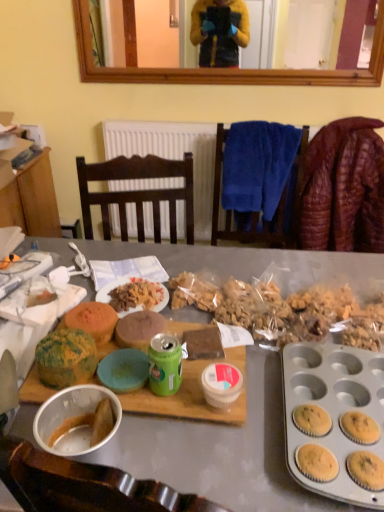
This screenshot has height=512, width=384. What do you see at coordinates (224, 450) in the screenshot? I see `matte gray desk at center` at bounding box center [224, 450].

This screenshot has height=512, width=384. Describe the element at coordinates (111, 289) in the screenshot. I see `matte plastic plate at center` at that location.

Measure the distance between matte plastic plate at center and camera.

A distance of 3.32 feet exists between matte plastic plate at center and camera.

Describe the element at coordinates (251, 213) in the screenshot. This screenshot has height=512, width=384. I see `blue soft towel at upper center` at that location.

You are a GUI agent. You are given a task and a screenshot of the screen. Output one action in this format:
    pyautogui.click(x=<x>, y=<y>)
    Task: Click on the matte gray desk at center
    
    Given the screenshot: What is the action you would take?
    pyautogui.click(x=224, y=450)

Between point (380, 170) and point (52, 342), which one is positioned in front?

Point (52, 342)

Between leather jacket at right and speckled yellow muffin at center-left, which appears as the second snack when viewed from the back, which one has larger width?

leather jacket at right.

Which is behind, leather jacket at right or speckled yellow muffin at center-left, which appears as the second snack when viewed from the back?

leather jacket at right is behind.

From a real-world perspective, which object stands above the other?

speckled yellow muffin at center-left, which is the 1th snack from front to back, from a real-world perspective.

Can you confirm if matte plastic plate at center is thinner than blue soft towel at upper center?

Incorrect, the width of matte plastic plate at center is not less than that of blue soft towel at upper center.

From the image's perspective, is matte plastic plate at center positioned above or below blue soft towel at upper center?

Clearly, from the image's perspective, matte plastic plate at center is below blue soft towel at upper center.

Based on their sizes in the image, would you say matte plastic plate at center is bigger or smaller than blue soft towel at upper center?

Clearly, matte plastic plate at center is smaller in size than blue soft towel at upper center.

From a real-world perspective, is matte plastic plate at center physically above blue soft towel at upper center?

No.

From the picture: Which object is thinner, speckled yellow muffin at center-left, which is the 1th snack from front to back, or matte plastic plate at center?

With smaller width is speckled yellow muffin at center-left, which is the 1th snack from front to back.

Is speckled yellow muffin at center-left, which appears as the second snack when viewed from the back, taller or shorter than matte plastic plate at center?

Considering their sizes, speckled yellow muffin at center-left, which appears as the second snack when viewed from the back, has more height than matte plastic plate at center.

From the picture: Can you see speckled yellow muffin at center-left, which is the 1th snack from front to back, touching matte plastic plate at center?

speckled yellow muffin at center-left, which is the 1th snack from front to back, and matte plastic plate at center are not in contact.

Can you confirm if speckled yellow muffin at center-left, which is the 1th snack from front to back, is smaller than matte plastic plate at center?

Yes.

Is point (55, 359) positioned after point (352, 262)?

No, (55, 359) is closer to viewer.

Is speckled yellow muffin at center-left, which is the 1th snack from front to back, touching matte gray desk at center?

No, speckled yellow muffin at center-left, which is the 1th snack from front to back, is not next to matte gray desk at center.

From the picture: Would you say speckled yellow muffin at center-left, which is the 1th snack from front to back, is inside or outside matte gray desk at center?

speckled yellow muffin at center-left, which is the 1th snack from front to back, is not enclosed by matte gray desk at center.

Who is taller, speckled yellow muffin at center-left, which appears as the second snack when viewed from the back, or matte gray desk at center?

matte gray desk at center is taller.

Where is `chair on the left of leather jacket at right`? This screenshot has height=512, width=384. chair on the left of leather jacket at right is located at coordinates (251, 213).

Is blue soft towel at upper center at the back of leather jacket at right?

No, blue soft towel at upper center is not at the back of leather jacket at right.

Looking at their sizes, would you say leather jacket at right is wider or thinner than blue soft towel at upper center?

In the image, leather jacket at right appears to be wider than blue soft towel at upper center.

Is leather jacket at right not within blue soft towel at upper center?

leather jacket at right is positioned outside blue soft towel at upper center.

Can you confirm if speckled yellow muffin at center-left, which appears as the second snack when viewed from the back, is taller than blue soft towel at upper center?

Incorrect, the height of speckled yellow muffin at center-left, which appears as the second snack when viewed from the back, is not larger of that of blue soft towel at upper center.

From the image's perspective, does speckled yellow muffin at center-left, which is the 1th snack from front to back, appear higher than blue soft towel at upper center?

No, from the image's perspective, speckled yellow muffin at center-left, which is the 1th snack from front to back, is not over blue soft towel at upper center.

What's the angular difference between speckled yellow muffin at center-left, which is the 1th snack from front to back, and blue soft towel at upper center's facing directions?

2.26 degrees.

Locate an element on the screen. The image size is (384, 512). chair located behind the speckled yellow muffin at center-left, which is the 1th snack from front to back is located at coordinates (251, 213).

The image size is (384, 512). I want to click on coffee cup positioned vertically above the matte plastic plate at center (from a real-world perspective), so click(165, 364).

Does point (153, 352) come farther from viewer compared to point (100, 294)?

No.

From the image's perspective, who appears lower, green matte can at center or matte plastic plate at center?

green matte can at center.

Where is `blanket above the speckled yellow muffin at center-left, which appears as the second snack when viewed from the back (from the image's perspective)`? Image resolution: width=384 pixels, height=512 pixels. blanket above the speckled yellow muffin at center-left, which appears as the second snack when viewed from the back (from the image's perspective) is located at coordinates (343, 188).

This screenshot has width=384, height=512. In order to click on plate located underneath the blue soft towel at upper center (from a real-world perspective) in this screenshot , I will do `click(111, 289)`.

Which object lies nearer to the anchor point speckled yellow muffin at center-left, which appears as the second snack when viewed from the back, matte gray desk at center or matte plastic plate at center?

matte plastic plate at center is closer to speckled yellow muffin at center-left, which appears as the second snack when viewed from the back.

Considering their positions, is speckled yellow muffin at center-left, which appears as the second snack when viewed from the back, positioned further to leather jacket at right than matte gray desk at center?

The object further to leather jacket at right is speckled yellow muffin at center-left, which appears as the second snack when viewed from the back.

Considering their positions, is green matte muffin at center-left, the 2th snack in the front-to-back sequence, positioned closer to green matte can at center than speckled yellow muffin at center-left, which is the 1th snack from front to back?

The object closer to green matte can at center is speckled yellow muffin at center-left, which is the 1th snack from front to back.

Based on their spatial positions, is speckled yellow muffin at center-left, which is the 1th snack from front to back, or green matte can at center closer to matte gray desk at center?

Among the two, green matte can at center is located nearer to matte gray desk at center.

In the scene shown: From the image, which object appears to be nearer to speckled yellow muffin at center-left, which appears as the second snack when viewed from the back, leather jacket at right or green matte can at center?

green matte can at center is positioned closer to the anchor speckled yellow muffin at center-left, which appears as the second snack when viewed from the back.

Based on their spatial positions, is matte plastic plate at center or green matte can at center further from leather jacket at right?

green matte can at center is further to leather jacket at right.

From the image, which object appears to be nearer to green matte can at center, matte plastic plate at center or speckled yellow muffin at center-left, which is the 1th snack from front to back?

speckled yellow muffin at center-left, which is the 1th snack from front to back, is positioned closer to the anchor green matte can at center.

From the image, which object appears to be farther from green matte muffin at center-left, the 2th snack in the front-to-back sequence, matte gray desk at center or blue soft towel at upper center?

Based on the image, blue soft towel at upper center appears to be further to green matte muffin at center-left, the 2th snack in the front-to-back sequence.

Where is `coffee cup between matte gray desk at center and green matte muffin at center-left, the 2th snack in the front-to-back sequence, in the front-back direction`? The height and width of the screenshot is (512, 384). coffee cup between matte gray desk at center and green matte muffin at center-left, the 2th snack in the front-to-back sequence, in the front-back direction is located at coordinates (165, 364).

You are a GUI agent. You are given a task and a screenshot of the screen. Output one action in this format:
    pyautogui.click(x=<x>, y=<y>)
    Task: Click on the snack between matte gray desk at center and green matte muffin at center-left, the 2th snack in the front-to-back sequence, along the z-axis
    The image size is (384, 512).
    Given the screenshot: What is the action you would take?
    pyautogui.click(x=66, y=358)

Where is `blanket between green matte can at center and blue soft towel at upper center in the front-back direction`? This screenshot has width=384, height=512. blanket between green matte can at center and blue soft towel at upper center in the front-back direction is located at coordinates (343, 188).

Locate an element on the screen. Image resolution: width=384 pixels, height=512 pixels. blanket between matte gray desk at center and blue soft towel at upper center from front to back is located at coordinates (343, 188).